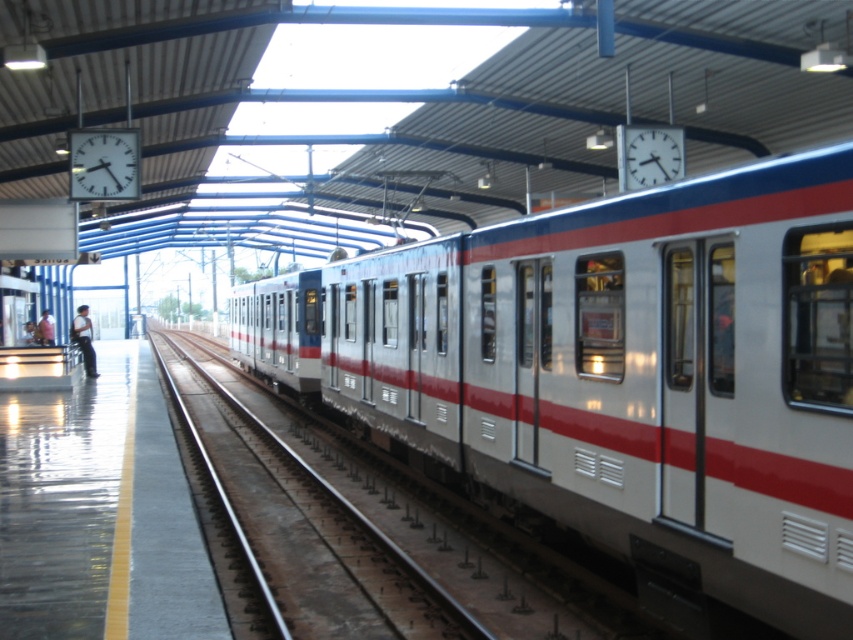
You are standing on the train station platform and want to walk from point (239, 492) to point (86, 337). Which direction should you move to get closer to the train?

You should move towards point (86, 337) because it is farther from the viewer compared to point (239, 492), meaning it is closer to the train track.

You are standing at the train station platform. There is a metallic track at center located at point [323,538]. If you were to walk towards the metallic track at center, which direction should you face to move directly towards it?

The metallic track at center is located at point [323,538], so you should face the center of the platform to move directly towards it.

You are a passenger waiting on the platform and see the silver metallic train at center and the light blue jeans at left. Which object is bigger?

The silver metallic train at center is larger in size than the light blue jeans at left.